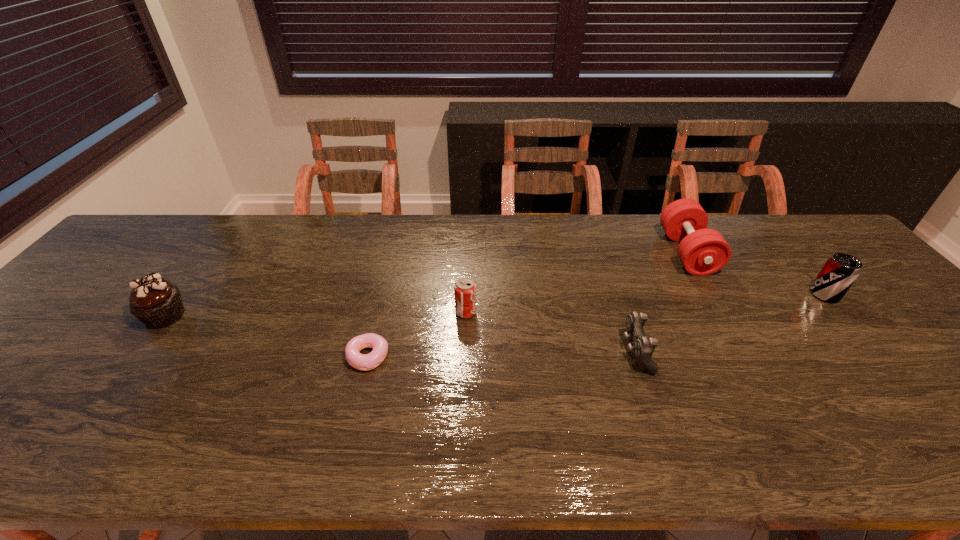
Locate an element on the screen. The width and height of the screenshot is (960, 540). doughnut is located at coordinates (365, 362).

I want to click on vacant space located on the left of the fifth object from left to right, so click(x=634, y=253).

Locate an element on the screen. free space located 0.340m on the front of the farther soda can is located at coordinates (931, 420).

Locate an element on the screen. Image resolution: width=960 pixels, height=540 pixels. free space located on the left of the cupcake is located at coordinates (78, 316).

Locate an element on the screen. The width and height of the screenshot is (960, 540). vacant space situated 0.090m on the left of the left soda can is located at coordinates (420, 312).

Find the location of a particular element. The height and width of the screenshot is (540, 960). free space located on the surface of the fourth object from left to right with buttons is located at coordinates (531, 352).

The height and width of the screenshot is (540, 960). What are the coordinates of `free spot located 0.110m on the surface of the fourth object from left to right with buttons` in the screenshot? It's located at (577, 352).

The height and width of the screenshot is (540, 960). In order to click on vacant region located 0.130m on the surface of the fourth object from left to right with buttons in this screenshot , I will do `click(568, 352)`.

At what (x,y) coordinates should I click in order to perform the action: click on vacant space situated 0.190m on the left of the shortest object. Please return your answer as a coordinate pair (x, y). Looking at the image, I should click on (266, 356).

Locate an element on the screen. object located in the far edge section of the desktop is located at coordinates (702, 251).